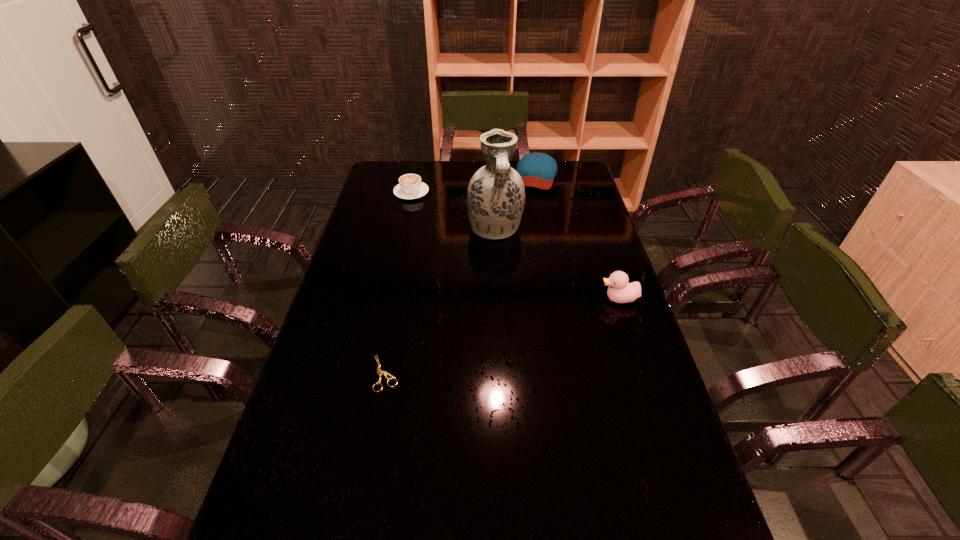
The width and height of the screenshot is (960, 540). I want to click on blank region between the duckling and the baseball cap, so click(x=577, y=237).

Select which object is the closest to the second nearest object. Please provide its 2D coordinates. Your answer should be formatted as a tuple, i.e. [(x, y)], where the tuple contains the x and y coordinates of a point satisfying the conditions above.

[(496, 194)]

Identify the location of object that is the closest to the rightmost object. (496, 194).

You are a GUI agent. You are given a task and a screenshot of the screen. Output one action in this format:
    pyautogui.click(x=<x>, y=<y>)
    Task: Click on the free space in the image that satisfies the following two spatial constraints: 1. on the back side of the nearest object; 2. on the front-facing side of the rightmost object
    This screenshot has height=540, width=960.
    Given the screenshot: What is the action you would take?
    pyautogui.click(x=399, y=299)

At what (x,y) coordinates should I click in order to perform the action: click on blank space that satisfies the following two spatial constraints: 1. on the back side of the baseball cap; 2. on the left side of the third farthest object. Please return your answer as a coordinate pair (x, y). This screenshot has width=960, height=540. Looking at the image, I should click on (492, 175).

This screenshot has width=960, height=540. I want to click on vacant area that satisfies the following two spatial constraints: 1. on the front side of the fourth tallest object; 2. on the front-facing side of the rightmost object, so click(388, 299).

Where is `vacant space that satisfies the following two spatial constraints: 1. on the back side of the shears; 2. on the right side of the vase`? vacant space that satisfies the following two spatial constraints: 1. on the back side of the shears; 2. on the right side of the vase is located at coordinates (x=413, y=229).

Image resolution: width=960 pixels, height=540 pixels. Identify the location of vacant space that satisfies the following two spatial constraints: 1. on the front side of the second shortest object; 2. on the left side of the vase. (403, 229).

The image size is (960, 540). In order to click on vacant space that satisfies the following two spatial constraints: 1. on the front side of the cappuccino; 2. on the front-facing side of the second tallest object in this screenshot , I will do [388, 299].